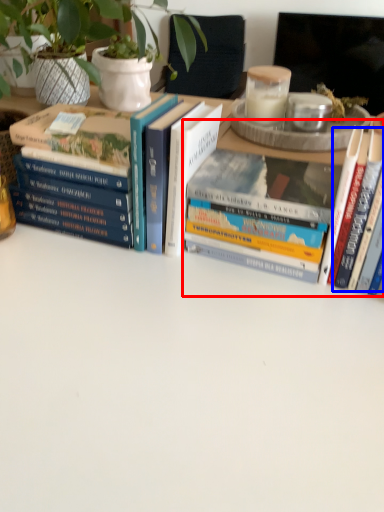
Question: Which of the following is the closest to the observer, book (highlighted by a red box) or book (highlighted by a blue box)?

Choices:
 (A) book
 (B) book

Answer: (B)